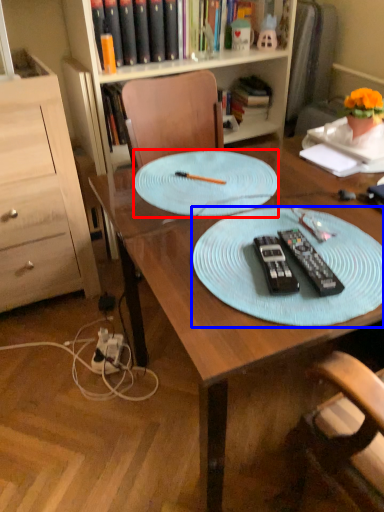
Question: Among these objects, which one is farthest to the camera, glass plate (highlighted by a red box) or platter (highlighted by a blue box)?

Choices:
 (A) glass plate
 (B) platter

Answer: (A)